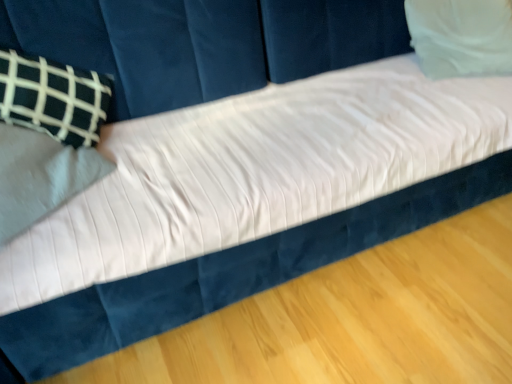
The height and width of the screenshot is (384, 512). In order to click on white soft pillow at upper right in this screenshot , I will do `click(461, 36)`.

What do you see at coordinates (461, 36) in the screenshot?
I see `white soft pillow at upper right` at bounding box center [461, 36].

Locate an element on the screen. white soft pillow at upper right is located at coordinates (461, 36).